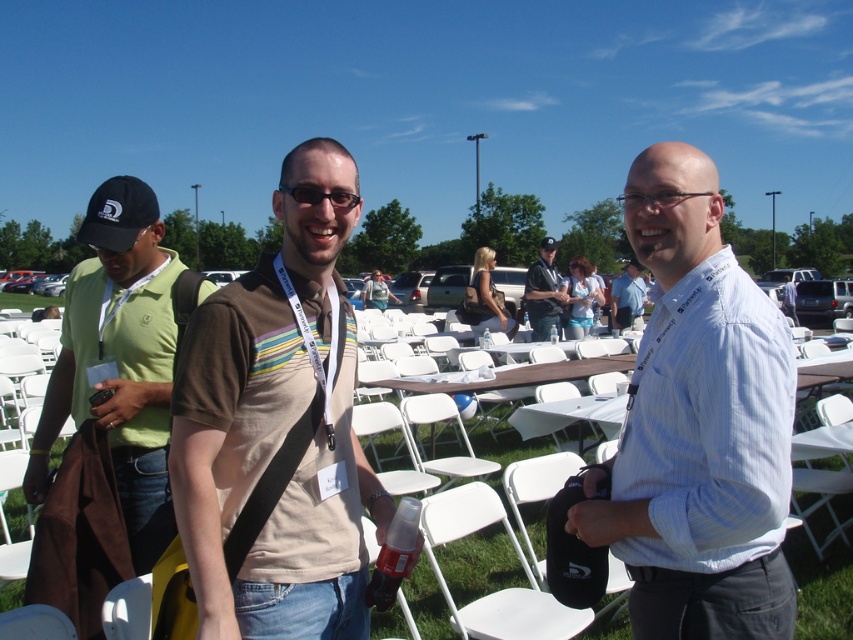
Is white striped shirt at center to the left of green fabric polo shirt at left from the viewer's perspective?

In fact, white striped shirt at center is to the right of green fabric polo shirt at left.

Between white striped shirt at center and green fabric polo shirt at left, which one is positioned lower?

Positioned lower is green fabric polo shirt at left.

Measure the distance between white striped shirt at center and camera.

The distance of white striped shirt at center from camera is 1.42 meters.

Where is `white striped shirt at center`? The image size is (853, 640). white striped shirt at center is located at coordinates (698, 426).

Consider the image. Between white plastic chair at lower center and black plastic glasses at center, which one has more height?

Standing taller between the two is white plastic chair at lower center.

Measure the distance between white plastic chair at lower center and camera.

9.16 feet

Which is behind, point (480, 524) or point (299, 195)?

The point (480, 524) is more distant.

Where is `white plastic chair at lower center`? The width and height of the screenshot is (853, 640). white plastic chair at lower center is located at coordinates (498, 589).

Who is more forward, (128, 218) or (305, 186)?

Point (305, 186) is more forward.

Which is behind, point (128, 204) or point (349, 195)?

Point (128, 204)

At what (x,y) coordinates should I click in order to perform the action: click on black fabric baseball cap at left. Please return your answer as a coordinate pair (x, y). Looking at the image, I should click on (119, 212).